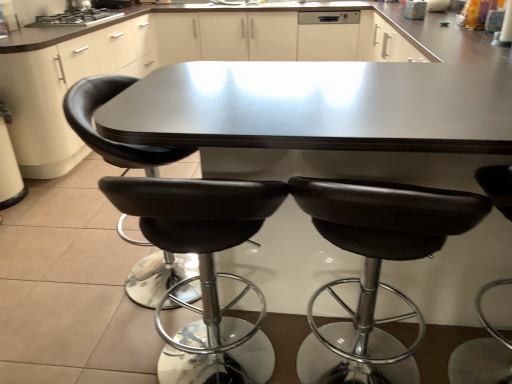
In order to click on free point above shiny dark wood table at center (from a real-world perspective) in this screenshot , I will do `click(300, 87)`.